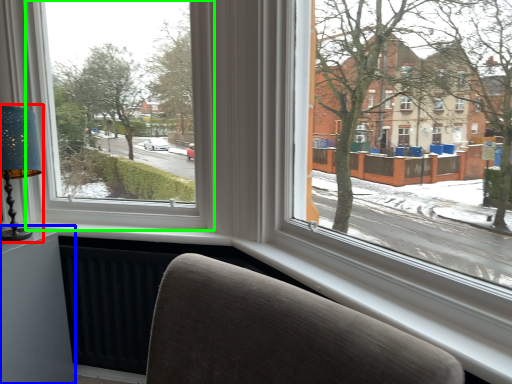
Question: Estimate the real-world distances between objects in this image. Which object is farther from table lamp (highlighted by a red box), table (highlighted by a blue box) or window (highlighted by a green box)?

Choices:
 (A) table
 (B) window

Answer: (A)